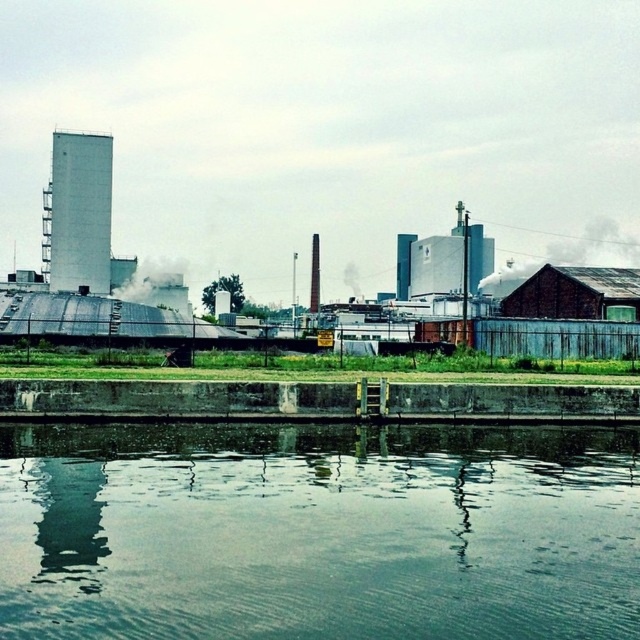
Can you confirm if green reflective water at center is bigger than white smoke at center?

No, green reflective water at center is not bigger than white smoke at center.

Consider the image. Between green reflective water at center and white smoke at center, which one appears on the left side from the viewer's perspective?

Positioned to the left is white smoke at center.

Does point (621, 468) come farther from viewer compared to point (124, 276)?

No, (621, 468) is in front of (124, 276).

Find the location of a particular element. This screenshot has height=640, width=640. green reflective water at center is located at coordinates (317, 531).

Does white smoke at upper right appear over white smoke at center?

Yes, white smoke at upper right is above white smoke at center.

Measure the distance between white smoke at upper right and camera.

61.85 meters

Where is `white smoke at upper right`? white smoke at upper right is located at coordinates (570, 257).

Does green reflective water at center have a greater width compared to white smoke at upper right?

In fact, green reflective water at center might be narrower than white smoke at upper right.

Looking at this image, can you confirm if green reflective water at center is smaller than white smoke at upper right?

Yes, green reflective water at center is smaller than white smoke at upper right.

Which is in front, point (426, 448) or point (580, 256)?

Point (426, 448)

The width and height of the screenshot is (640, 640). Identify the location of green reflective water at center. (317, 531).